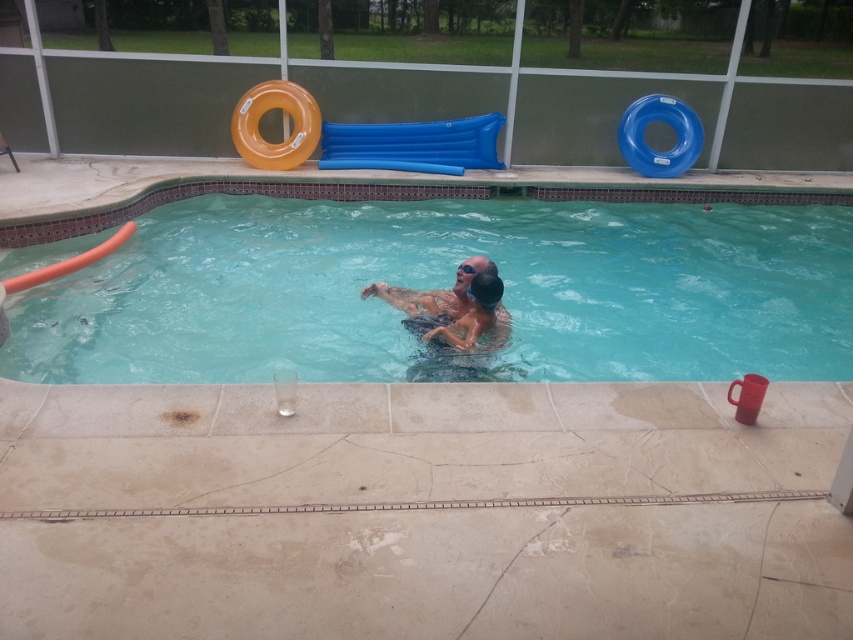
Between black rubber swim cap at center and clear plastic goggles at upper center, which one appears on the right side from the viewer's perspective?

clear plastic goggles at upper center is more to the right.

Who is higher up, black rubber swim cap at center or clear plastic goggles at upper center?

clear plastic goggles at upper center is above.

Between point (467, 333) and point (462, 268), which one is positioned behind?

Point (462, 268)

Find the location of a particular element. The height and width of the screenshot is (640, 853). black rubber swim cap at center is located at coordinates (473, 314).

Who is more forward, [646,312] or [495,278]?

Answer: Point [495,278] is in front.

Does clear plastic pool at center appear on the left side of black rubber swim cap at center?

Incorrect, clear plastic pool at center is not on the left side of black rubber swim cap at center.

Image resolution: width=853 pixels, height=640 pixels. Describe the element at coordinates (445, 282) in the screenshot. I see `clear plastic pool at center` at that location.

I want to click on clear plastic pool at center, so click(445, 282).

Who is positioned more to the right, black rubber swim cap at center or orange rubber slide at upper left?

Positioned to the right is black rubber swim cap at center.

Is point (479, 333) farther from camera compared to point (67, 272)?

No, it is in front of (67, 272).

In order to click on black rubber swim cap at center in this screenshot , I will do coord(473,314).